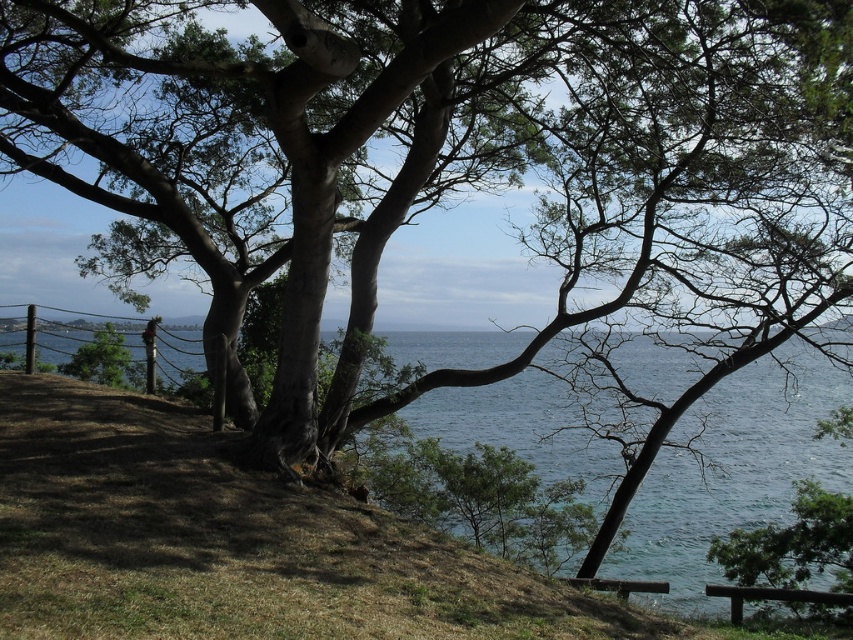
Question: Which object appears closest to the camera in this image?

Choices:
 (A) green leafy tree at lower right
 (B) brown wooden bench at lower right

Answer: (B)

Question: Is green leafy tree at lower right thinner than brown wooden bench at lower right?

Choices:
 (A) no
 (B) yes

Answer: (A)

Question: Which point is closer to the camera?

Choices:
 (A) green leafy tree at lower right
 (B) brown wooden bench at lower right

Answer: (B)

Question: Among these points, which one is farthest from the camera?

Choices:
 (A) (843, 570)
 (B) (740, 614)

Answer: (A)

Question: Is green leafy tree at lower right closer to camera compared to brown wooden bench at lower right?

Choices:
 (A) no
 (B) yes

Answer: (A)

Question: Does green leafy tree at lower right have a lesser width compared to brown wooden bench at lower right?

Choices:
 (A) no
 (B) yes

Answer: (A)